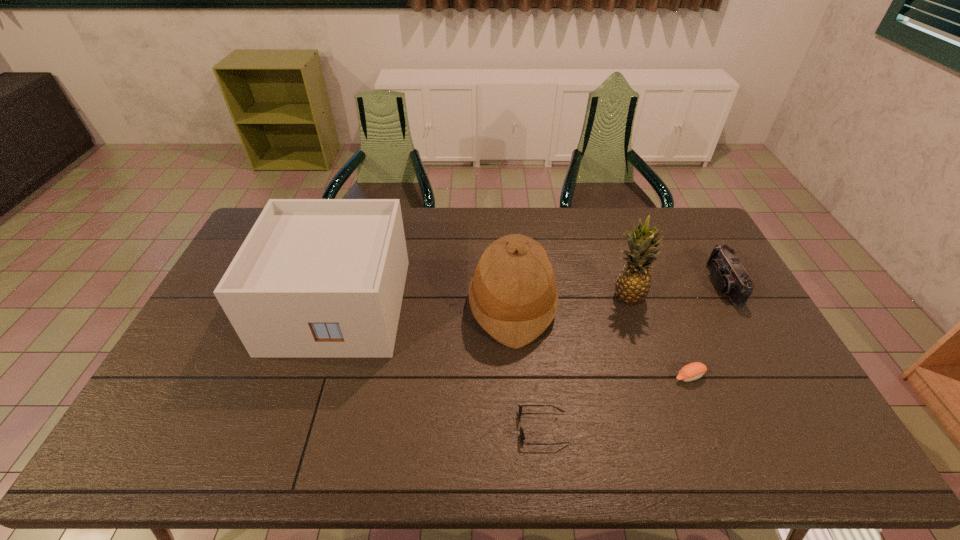
At what (x,y) coordinates should I click in order to perform the action: click on vacant space located on the front-facing side of the shortest object. Please return your answer as a coordinate pair (x, y). The height and width of the screenshot is (540, 960). Looking at the image, I should click on (388, 428).

Locate an element on the screen. The image size is (960, 540). object at the near edge is located at coordinates (522, 437).

Identify the location of object at the right edge. This screenshot has width=960, height=540. (732, 279).

At what (x,y) coordinates should I click in order to perform the action: click on free space at the far edge of the desktop. Please return your answer as a coordinate pair (x, y). Looking at the image, I should click on (429, 230).

I want to click on vacant space at the near edge of the desktop, so click(653, 434).

Locate an element on the screen. vacant region at the left edge of the desktop is located at coordinates (231, 347).

Locate an element on the screen. free space at the right edge of the desktop is located at coordinates (810, 428).

Locate an element on the screen. The width and height of the screenshot is (960, 540). free area in between the third shortest object and the pineapple is located at coordinates (675, 290).

You are a GUI agent. You are given a task and a screenshot of the screen. Output one action in this format:
    pyautogui.click(x=<x>, y=<y>)
    Task: Click on the empty space that is in between the fifth tallest object and the pineapple
    Image resolution: width=960 pixels, height=540 pixels.
    Given the screenshot: What is the action you would take?
    pyautogui.click(x=658, y=336)

Locate an element on the screen. vacant point located between the rightmost object and the fifth farthest object is located at coordinates (706, 330).